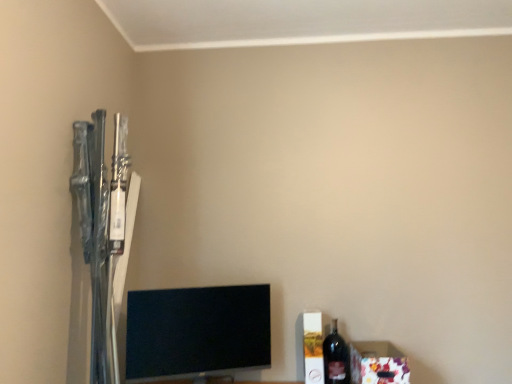
Question: Considering the relative positions of floral paper box at lower right and black glossy tv at lower center in the image provided, is floral paper box at lower right in front of black glossy tv at lower center?

Choices:
 (A) no
 (B) yes

Answer: (A)

Question: Would you consider floral paper box at lower right to be distant from black glossy tv at lower center?

Choices:
 (A) no
 (B) yes

Answer: (A)

Question: From a real-world perspective, is floral paper box at lower right physically below black glossy tv at lower center?

Choices:
 (A) no
 (B) yes

Answer: (B)

Question: Does floral paper box at lower right have a lesser height compared to black glossy tv at lower center?

Choices:
 (A) yes
 (B) no

Answer: (A)

Question: Can you confirm if floral paper box at lower right is taller than black glossy tv at lower center?

Choices:
 (A) yes
 (B) no

Answer: (B)

Question: Is black glossy tv at lower center in front of or behind floral paper box at lower right in the image?

Choices:
 (A) behind
 (B) front

Answer: (B)

Question: From the image's perspective, is black glossy tv at lower center above or below floral paper box at lower right?

Choices:
 (A) below
 (B) above

Answer: (B)

Question: From a real-world perspective, is black glossy tv at lower center positioned above or below floral paper box at lower right?

Choices:
 (A) below
 (B) above

Answer: (B)

Question: Is black glossy tv at lower center bigger or smaller than floral paper box at lower right?

Choices:
 (A) small
 (B) big

Answer: (B)

Question: From the image's perspective, is dark glass bottle at lower right located above or below black glossy tv at lower center?

Choices:
 (A) below
 (B) above

Answer: (A)

Question: Does point (327, 354) appear closer or farther from the camera than point (173, 324)?

Choices:
 (A) closer
 (B) farther

Answer: (B)

Question: Looking at their shapes, would you say dark glass bottle at lower right is wider or thinner than black glossy tv at lower center?

Choices:
 (A) wide
 (B) thin

Answer: (B)

Question: Considering the positions of dark glass bottle at lower right and black glossy tv at lower center in the image, is dark glass bottle at lower right taller or shorter than black glossy tv at lower center?

Choices:
 (A) short
 (B) tall

Answer: (A)

Question: In the image, is black glossy tv at lower center positioned in front of or behind dark glass bottle at lower right?

Choices:
 (A) front
 (B) behind

Answer: (A)

Question: From the image's perspective, relative to dark glass bottle at lower right, is black glossy tv at lower center above or below?

Choices:
 (A) below
 (B) above

Answer: (B)